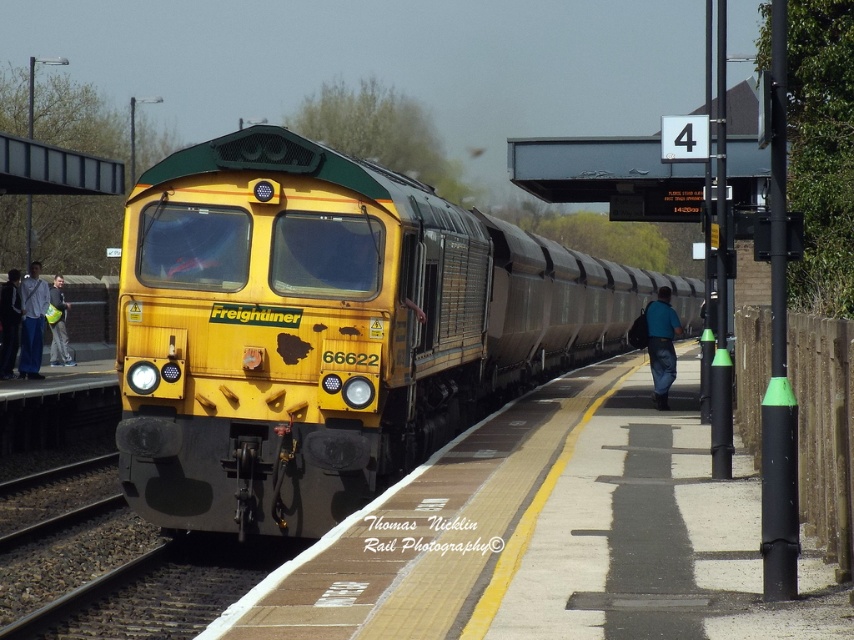
Question: Which is nearer to the blue fabric backpack at platform?

Choices:
 (A) dark blue jeans at left
 (B) denim jacket at left
 (C) light gray fabric jacket at left
 (D) yellow matte freightliner at center

Answer: (D)

Question: Which point appears closest to the camera in this image?

Choices:
 (A) click(x=44, y=292)
 (B) click(x=395, y=380)
 (C) click(x=673, y=369)

Answer: (B)

Question: Can you confirm if denim jacket at left is smaller than light gray fabric jacket at left?

Choices:
 (A) yes
 (B) no

Answer: (A)

Question: Does denim jacket at left appear over light gray fabric jacket at left?

Choices:
 (A) no
 (B) yes

Answer: (A)

Question: Does yellow matte freightliner at center have a lesser width compared to blue fabric backpack at platform?

Choices:
 (A) no
 (B) yes

Answer: (A)

Question: Which of the following is the farthest from the observer?

Choices:
 (A) (x=12, y=288)
 (B) (x=661, y=312)

Answer: (A)